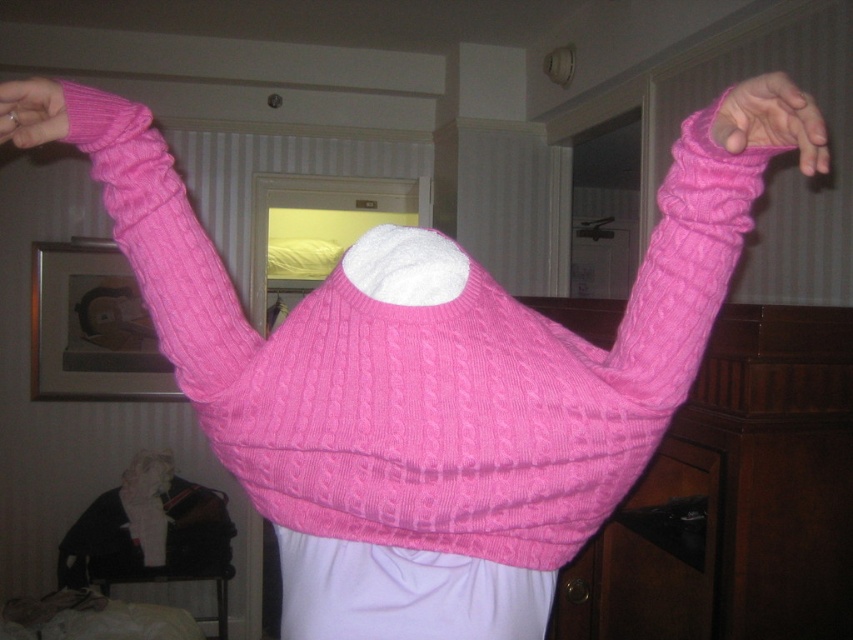
You are designing a display for a clothing store and need to arrange two sweaters based on their sizes. The scene shows a person wearing the pink knitted sweater at upper right and another matte pink sweater at upper left. Which sweater should you place in a larger display area to match their actual sizes?

The pink knitted sweater at upper right should be placed in a larger display area because it has a larger size compared to the matte pink sweater at upper left.